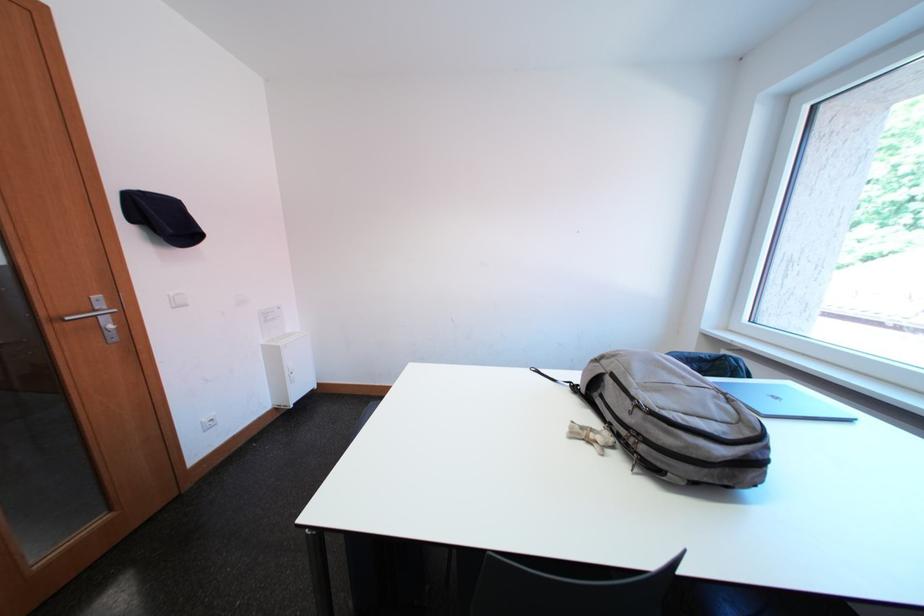
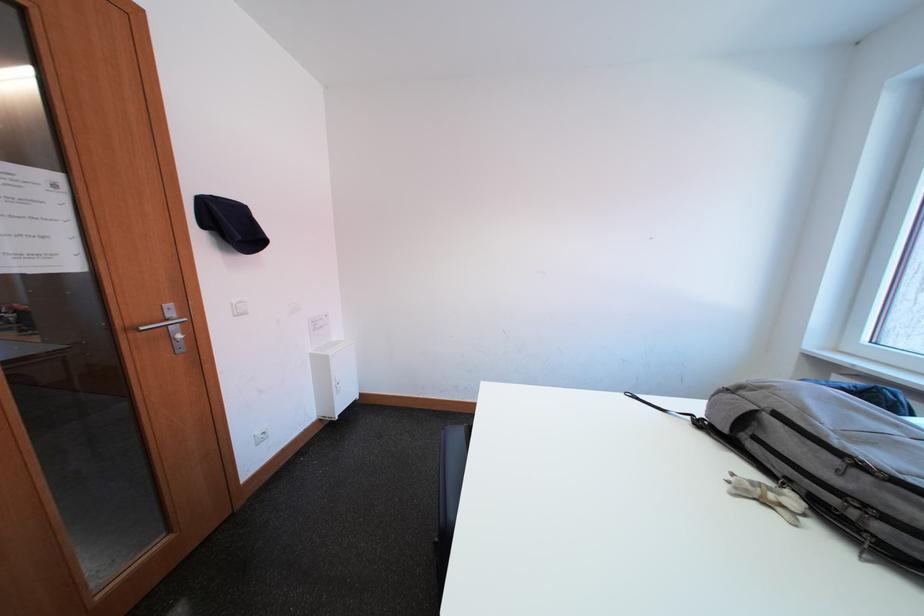
Question: The camera is either moving clockwise (left) or counter-clockwise (right) around the object. The first image is from the beginning of the video and the second image is from the end. Is the camera moving left or right when shooting the video?

Choices:
 (A) Left
 (B) Right

Answer: (B)